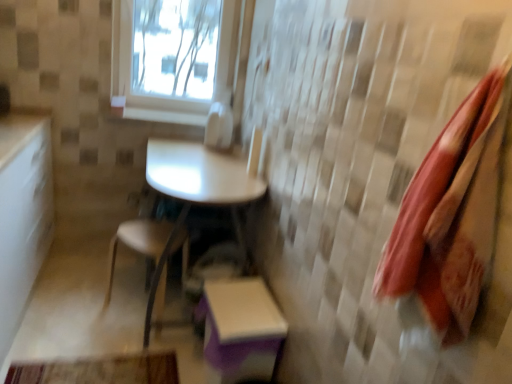
Question: Is white glossy table at center not within transparent glass window at upper center?

Choices:
 (A) no
 (B) yes

Answer: (B)

Question: Is transparent glass window at upper center a part of white glossy table at center?

Choices:
 (A) no
 (B) yes

Answer: (A)

Question: Does white glossy table at center turn towards transparent glass window at upper center?

Choices:
 (A) yes
 (B) no

Answer: (B)

Question: Does white glossy table at center lie in front of transparent glass window at upper center?

Choices:
 (A) no
 (B) yes

Answer: (B)

Question: Considering the relative sizes of white glossy table at center and transparent glass window at upper center in the image provided, is white glossy table at center thinner than transparent glass window at upper center?

Choices:
 (A) yes
 (B) no

Answer: (B)

Question: Considering the positions of transparent glass window at upper center and white glossy window sill at upper center in the image, is transparent glass window at upper center bigger or smaller than white glossy window sill at upper center?

Choices:
 (A) big
 (B) small

Answer: (A)

Question: Is transparent glass window at upper center inside or outside of white glossy window sill at upper center?

Choices:
 (A) outside
 (B) inside

Answer: (A)

Question: Considering the positions of point (230, 59) and point (195, 109), is point (230, 59) closer or farther from the camera than point (195, 109)?

Choices:
 (A) farther
 (B) closer

Answer: (A)

Question: From a real-world perspective, is transparent glass window at upper center above or below white glossy window sill at upper center?

Choices:
 (A) above
 (B) below

Answer: (A)

Question: From their relative heights in the image, would you say white glossy window sill at upper center is taller or shorter than transparent glass window at upper center?

Choices:
 (A) short
 (B) tall

Answer: (A)

Question: From a real-world perspective, relative to transparent glass window at upper center, is white glossy window sill at upper center vertically above or below?

Choices:
 (A) above
 (B) below

Answer: (B)

Question: Considering their positions, is white glossy window sill at upper center located in front of or behind transparent glass window at upper center?

Choices:
 (A) behind
 (B) front

Answer: (A)

Question: Based on their sizes in the image, would you say white glossy window sill at upper center is bigger or smaller than transparent glass window at upper center?

Choices:
 (A) small
 (B) big

Answer: (A)

Question: Does point (244, 342) appear closer or farther from the camera than point (119, 104)?

Choices:
 (A) closer
 (B) farther

Answer: (A)

Question: Is purple matte step stool at lower center wider or thinner than white glossy window sill at upper center?

Choices:
 (A) wide
 (B) thin

Answer: (A)